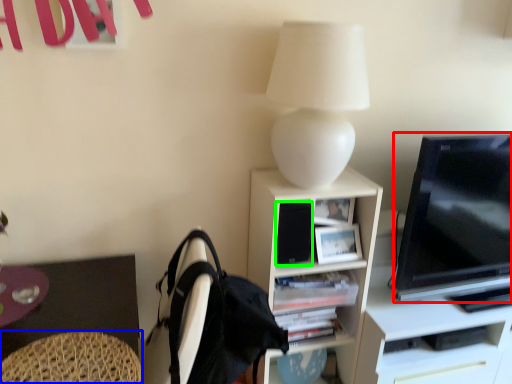
Question: Based on their relative distances, which object is nearer to television (highlighted by a red box)? Choose from swivel chair (highlighted by a blue box) and speaker (highlighted by a green box).

Choices:
 (A) swivel chair
 (B) speaker

Answer: (B)